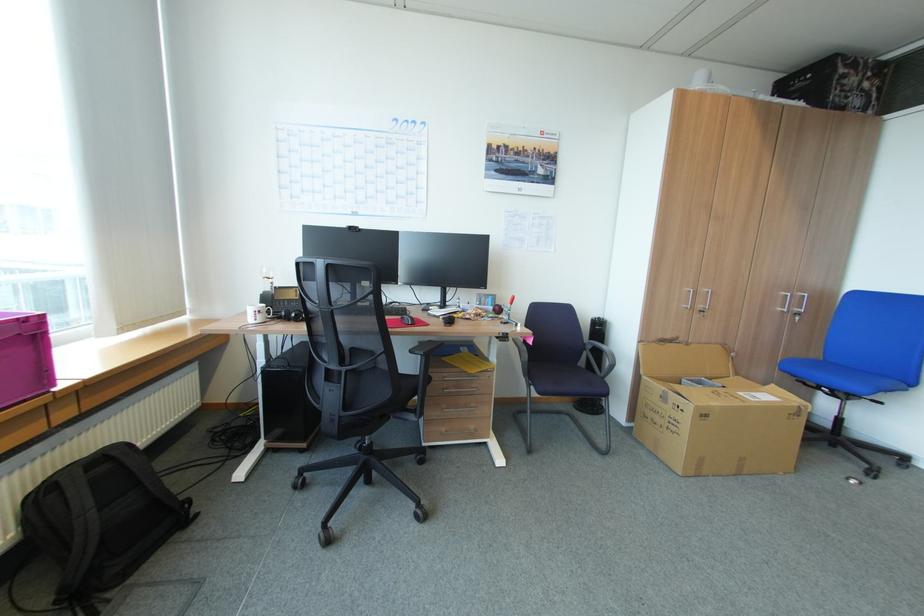
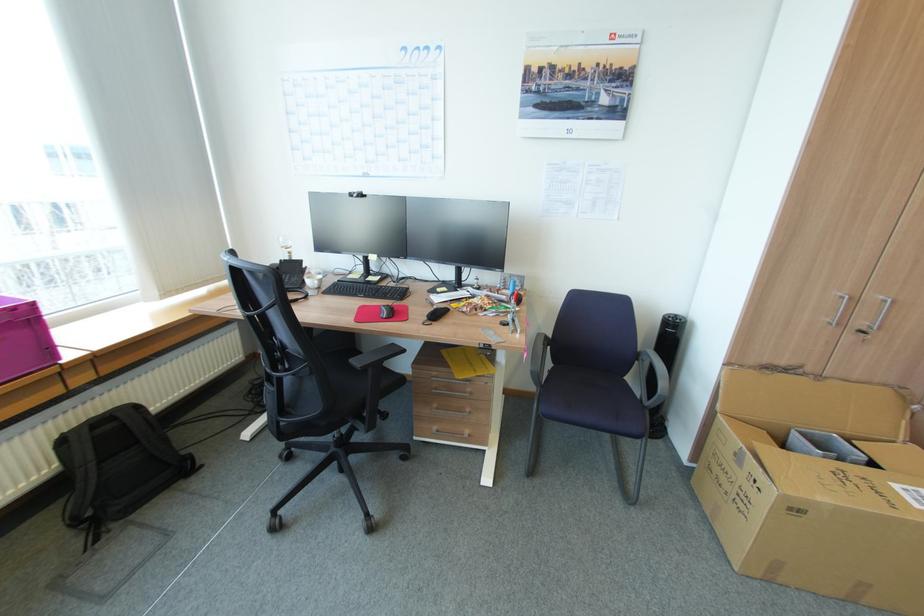
Find the pixel in the second image that matches point 29,321 in the first image.

(21, 309)